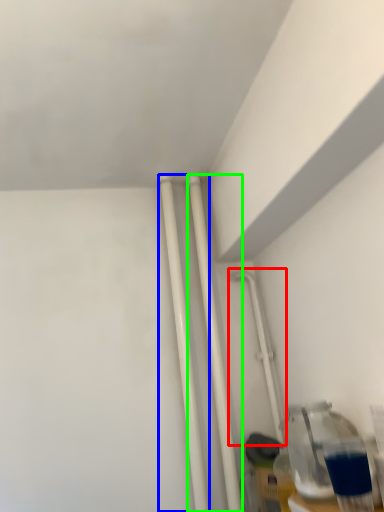
Question: Considering the real-world distances, which object is closest to water pipe (highlighted by a red box)? pipe (highlighted by a blue box) or pipe (highlighted by a green box).

Choices:
 (A) pipe
 (B) pipe

Answer: (B)